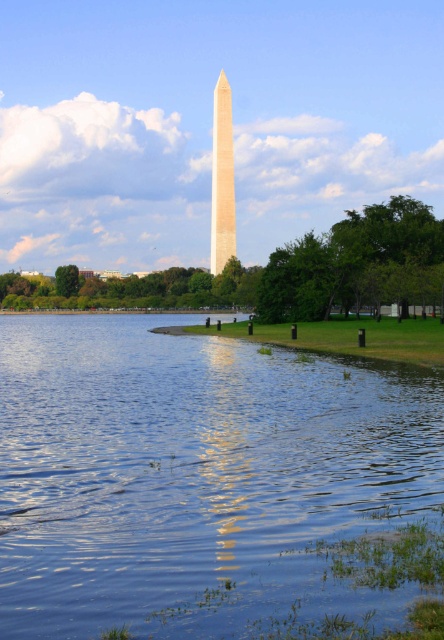
Question: From the image, what is the correct spatial relationship of blue glassy water at center in relation to beige stone obelisk at center?

Choices:
 (A) right
 (B) left

Answer: (A)

Question: Which point is closer to the camera?

Choices:
 (A) blue glassy water at center
 (B) beige stone obelisk at center

Answer: (A)

Question: Is blue glassy water at center to the left of beige stone obelisk at center from the viewer's perspective?

Choices:
 (A) no
 (B) yes

Answer: (A)

Question: Among these objects, which one is farthest from the camera?

Choices:
 (A) blue glassy water at center
 (B) beige stone obelisk at center

Answer: (B)

Question: Does blue glassy water at center have a greater width compared to beige stone obelisk at center?

Choices:
 (A) yes
 (B) no

Answer: (A)

Question: Which point is closer to the camera taking this photo?

Choices:
 (A) (x=232, y=209)
 (B) (x=46, y=545)

Answer: (B)